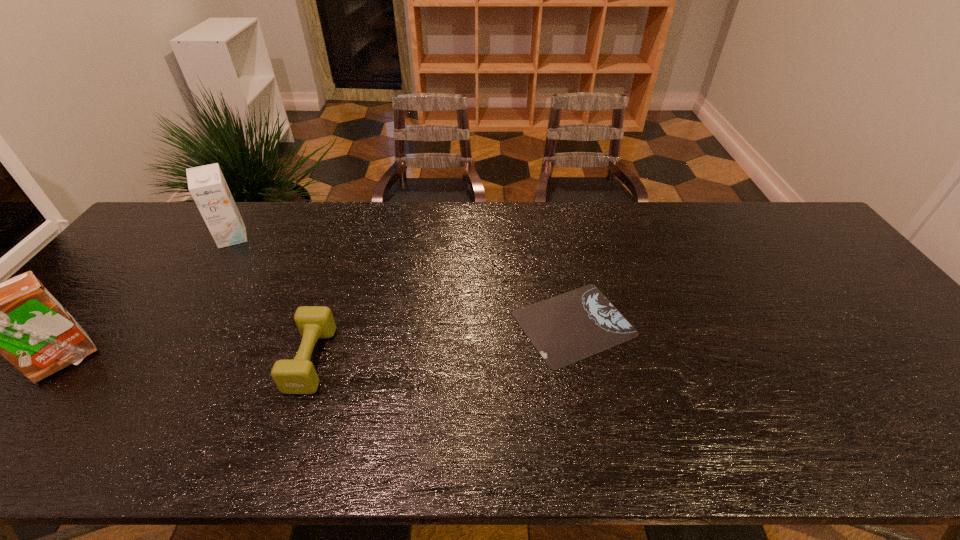
Where is `blank area in the image that satisfies the following two spatial constraints: 1. on the front side of the farther carton; 2. on the right side of the second object from right to left`? This screenshot has width=960, height=540. blank area in the image that satisfies the following two spatial constraints: 1. on the front side of the farther carton; 2. on the right side of the second object from right to left is located at coordinates (152, 360).